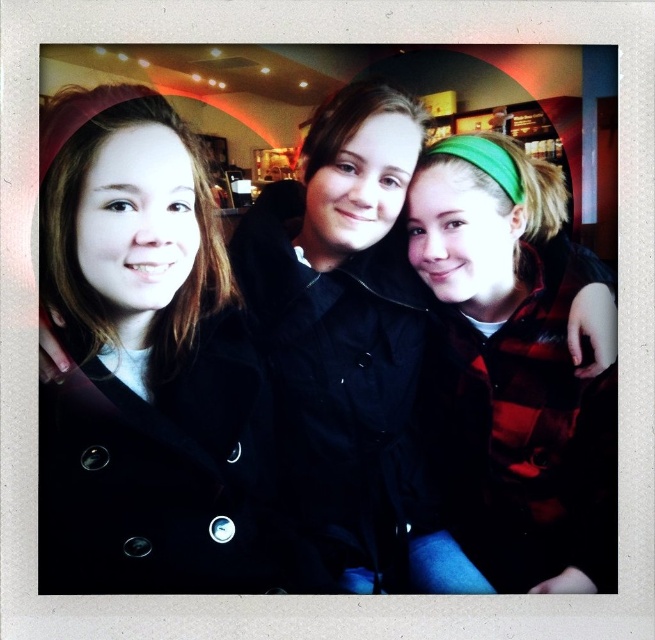
Question: In this image, where is matte black coat at left located relative to green plaid shirt at center?

Choices:
 (A) above
 (B) below

Answer: (A)

Question: Among these points, which one is nearest to the camera?

Choices:
 (A) (521, 248)
 (B) (172, 120)

Answer: (B)

Question: Which point is closer to the camera?

Choices:
 (A) matte black coat at left
 (B) green plaid shirt at center

Answer: (A)

Question: Does matte black coat at left appear over green plaid shirt at center?

Choices:
 (A) no
 (B) yes

Answer: (B)

Question: Observing the image, what is the correct spatial positioning of matte black coat at left in reference to green plaid shirt at center?

Choices:
 (A) right
 (B) left

Answer: (B)